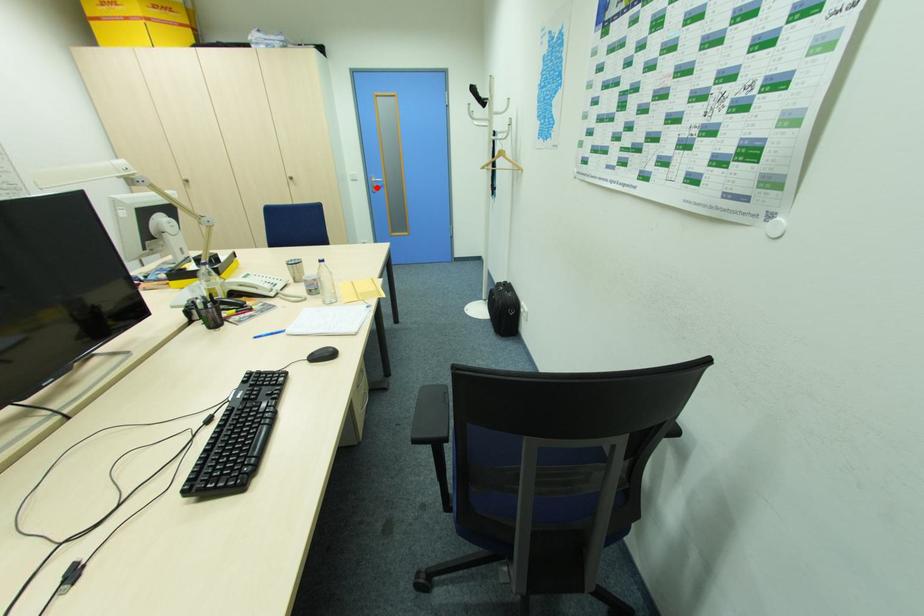
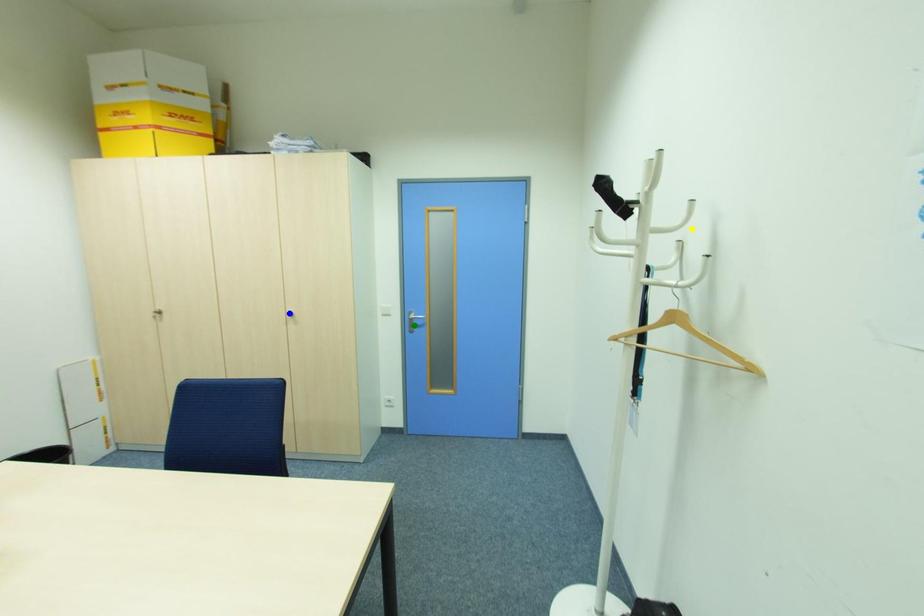
Question: I am providing you with two images of the same scene from different viewpoints. A red point is marked on the first image. You are given multiple points on the second image. Which spot in image 2 lines up with the point in image 1?

Choices:
 (A) green point
 (B) yellow point
 (C) blue point

Answer: (A)